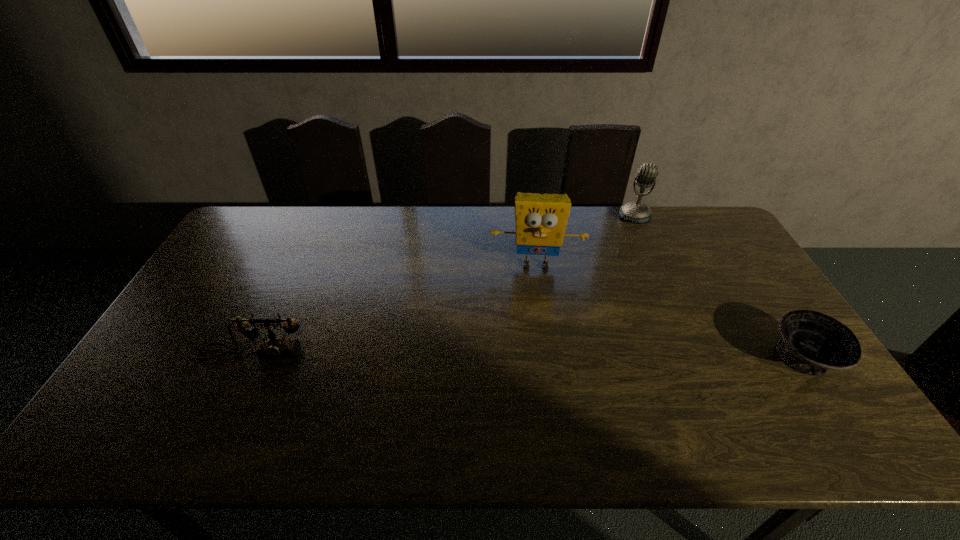
Find the location of a particular element. vacant position in the image that satisfies the following two spatial constraints: 1. on the front-facing side of the third tallest object; 2. on the left side of the bowl is located at coordinates (252, 358).

Find the location of a particular element. The height and width of the screenshot is (540, 960). blank area in the image that satisfies the following two spatial constraints: 1. on the front side of the third object from right to left; 2. on the right side of the rightmost object is located at coordinates (549, 358).